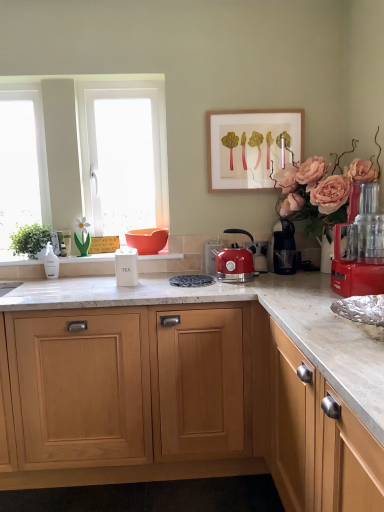
The height and width of the screenshot is (512, 384). I want to click on free space above black plastic coffee machine at right, the 2th coffee machine from the back (from a real-world perspective), so click(x=288, y=218).